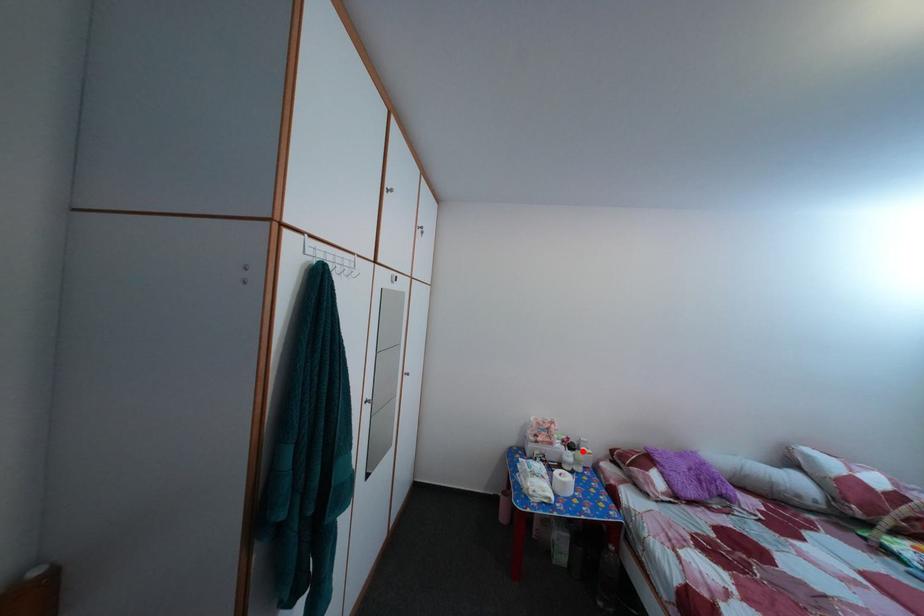
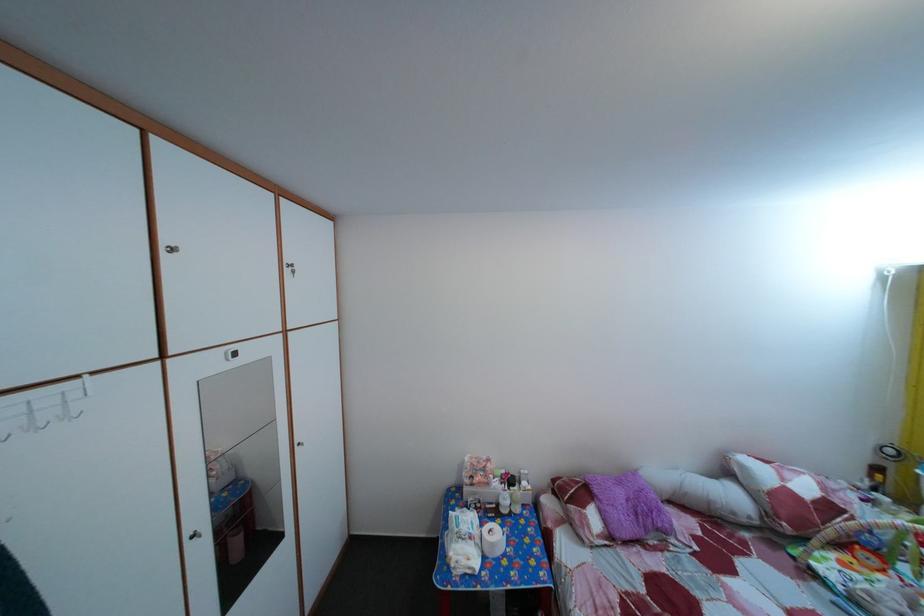
Question: I am providing you with two images of the same scene from different viewpoints. Image1 has a red point marked. In image2, the corresponding 3D location appears at what relative position? Reply with the corresponding letter.

Choices:
 (A) Closer
 (B) Farther

Answer: (A)